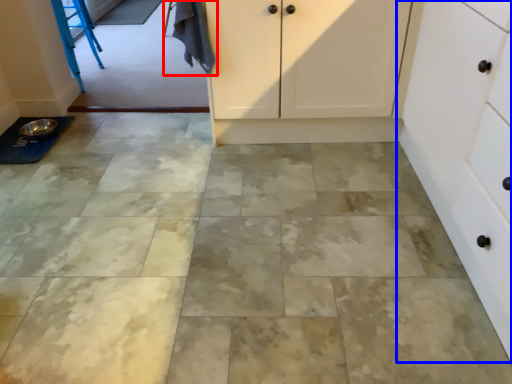
Question: Which point is closer to the camera, laundry (highlighted by a red box) or cabinetry (highlighted by a blue box)?

Choices:
 (A) laundry
 (B) cabinetry

Answer: (B)